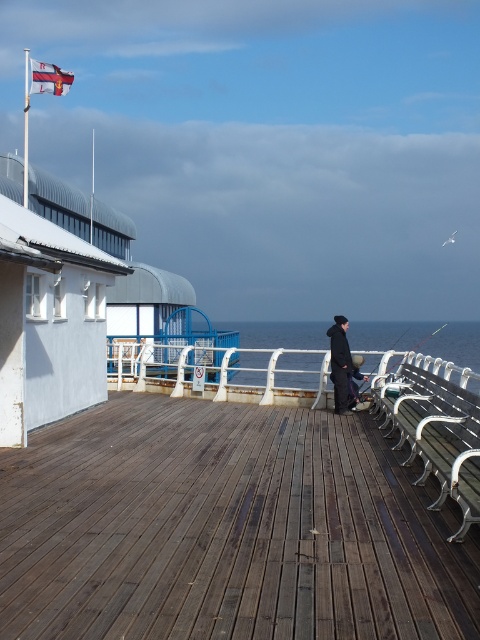
Is brown wooden deck at center smaller than green metal bench at right?

Actually, brown wooden deck at center might be larger than green metal bench at right.

Is brown wooden deck at center to the left of green metal bench at right from the viewer's perspective?

Yes, brown wooden deck at center is to the left of green metal bench at right.

This screenshot has height=640, width=480. I want to click on brown wooden deck at center, so click(x=225, y=529).

Which of these two, green metal bench at right or metallic fishing pole at right, stands shorter?

green metal bench at right

Can you confirm if green metal bench at right is positioned below metallic fishing pole at right?

No.

At what (x,y) coordinates should I click in order to perform the action: click on green metal bench at right. Please return your answer as a coordinate pair (x, y). The image size is (480, 640). Looking at the image, I should click on (435, 433).

How distant is brown wooden deck at center from white metal rail at center?

A distance of 7.03 meters exists between brown wooden deck at center and white metal rail at center.

Who is positioned more to the left, brown wooden deck at center or white metal rail at center?

From the viewer's perspective, white metal rail at center appears more on the left side.

What do you see at coordinates (225, 529) in the screenshot? I see `brown wooden deck at center` at bounding box center [225, 529].

Locate an element on the screen. This screenshot has width=480, height=640. brown wooden deck at center is located at coordinates (225, 529).